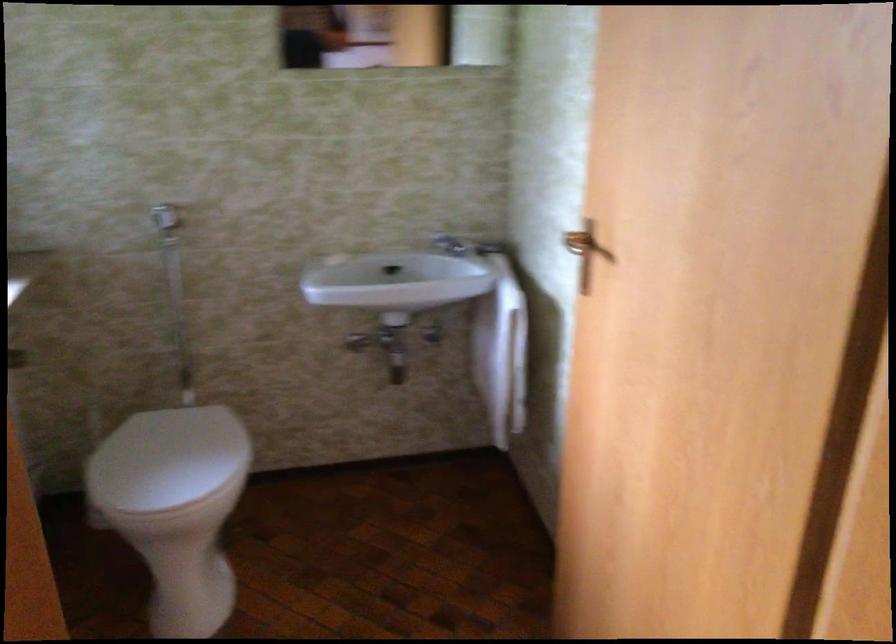
Locate an element on the screen. Image resolution: width=896 pixels, height=644 pixels. toilet flush button is located at coordinates (165, 216).